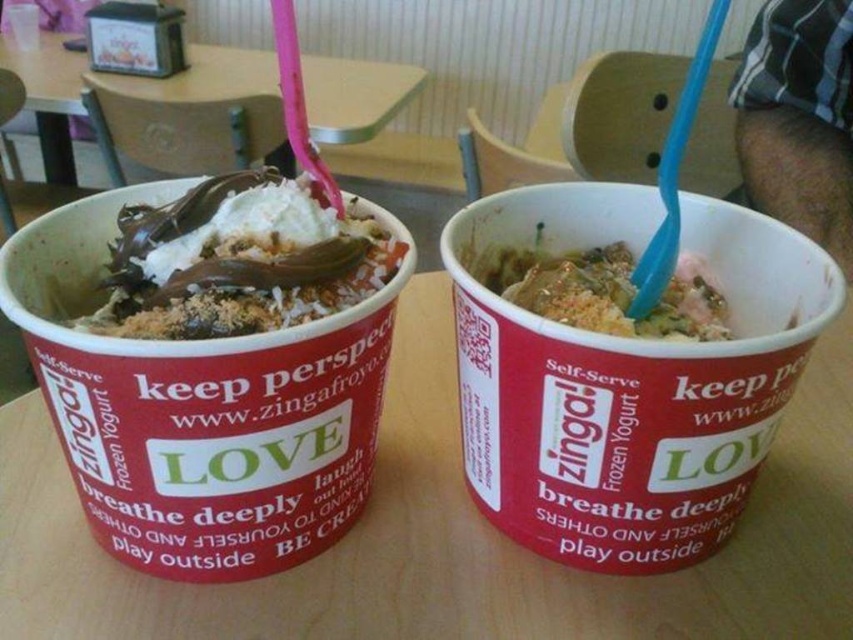
You are a customer at a frozen yogurt shop and see the wooden table at upper center and the crumbly brown topping at center. Can you tell me which one is higher?

The wooden table at upper center is taller than the crumbly brown topping at center.